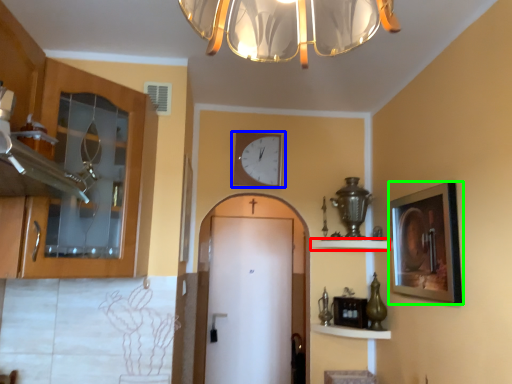
Question: Based on their relative distances, which object is nearer to shelf (highlighted by a red box)? Choose from wall clock (highlighted by a blue box) and picture frame (highlighted by a green box).

Choices:
 (A) wall clock
 (B) picture frame

Answer: (B)